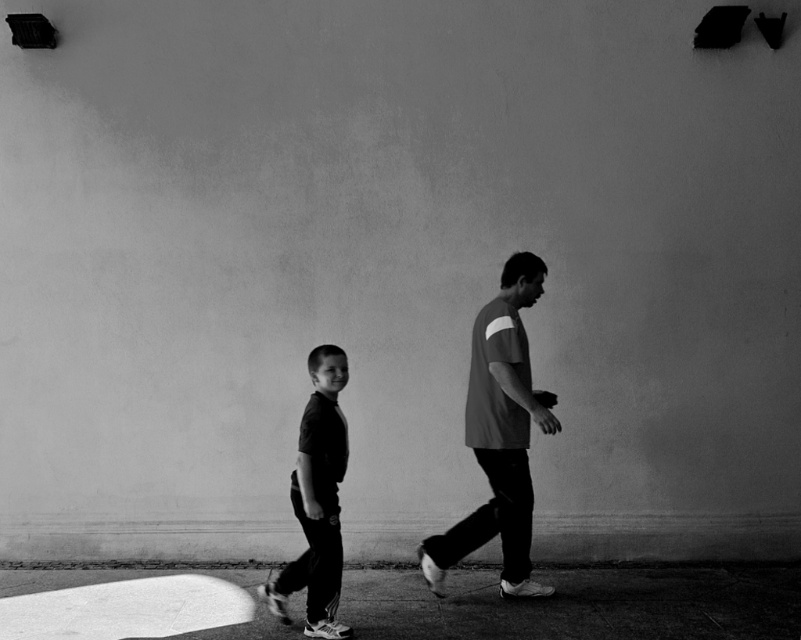
Question: Is gray cotton shirt at center smaller than dark gray fabric pants at left?

Choices:
 (A) no
 (B) yes

Answer: (A)

Question: Which point is closer to the camera?

Choices:
 (A) (292, 500)
 (B) (513, 451)

Answer: (A)

Question: Can you confirm if gray cotton shirt at center is positioned above dark gray fabric pants at left?

Choices:
 (A) no
 (B) yes

Answer: (B)

Question: Where is gray cotton shirt at center located in relation to dark gray fabric pants at left in the image?

Choices:
 (A) right
 (B) left

Answer: (A)